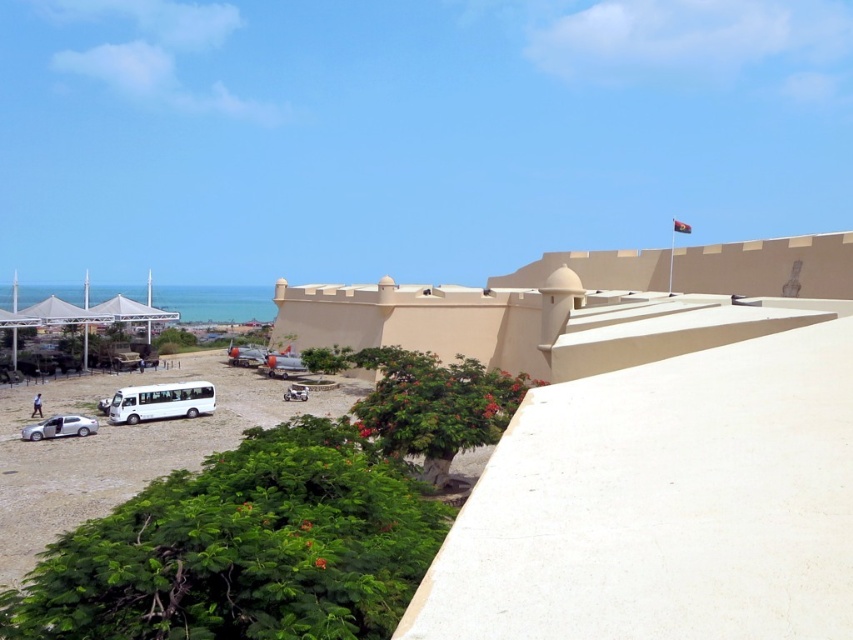
Which is more to the right, silver metallic car at lower left or white matte car at center?

From the viewer's perspective, white matte car at center appears more on the right side.

Which is more to the left, silver metallic car at lower left or white matte car at center?

silver metallic car at lower left is more to the left.

Is point (50, 436) positioned after point (294, 394)?

No, (50, 436) is in front of (294, 394).

Where is `silver metallic car at lower left`? silver metallic car at lower left is located at coordinates (61, 428).

Which is below, white matte van at lower left or white matte car at center?

Positioned lower is white matte car at center.

Between white matte van at lower left and white matte car at center, which one appears on the right side from the viewer's perspective?

Positioned to the right is white matte car at center.

This screenshot has height=640, width=853. Describe the element at coordinates (161, 401) in the screenshot. I see `white matte van at lower left` at that location.

This screenshot has height=640, width=853. In order to click on white matte van at lower left in this screenshot , I will do `click(161, 401)`.

Is white matte van at lower left to the right of silver metallic car at lower left from the viewer's perspective?

Indeed, white matte van at lower left is positioned on the right side of silver metallic car at lower left.

This screenshot has height=640, width=853. I want to click on white matte van at lower left, so click(x=161, y=401).

Locate an element on the screen. This screenshot has height=640, width=853. white matte van at lower left is located at coordinates (161, 401).